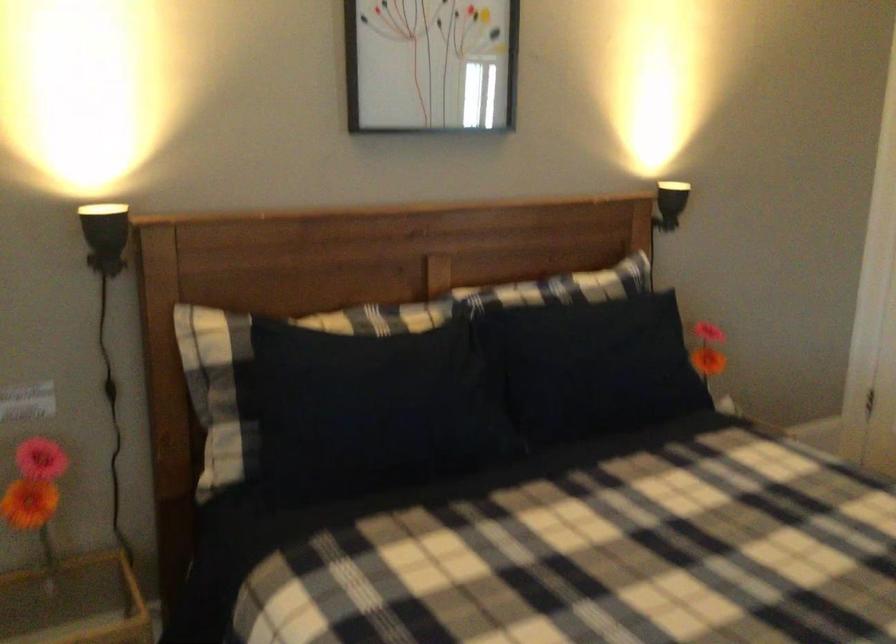
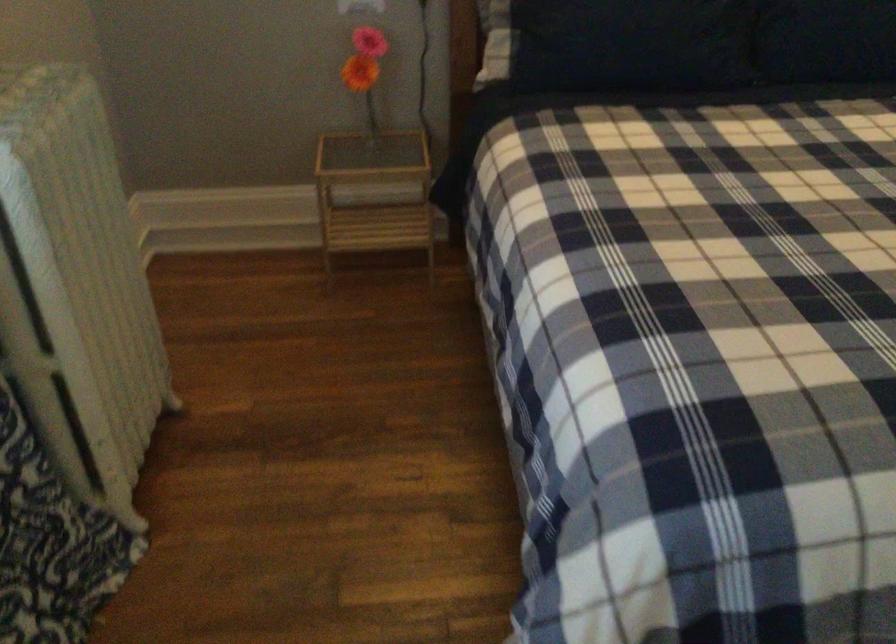
Find the pixel in the second image that matches point (600, 404) in the first image.

(830, 43)